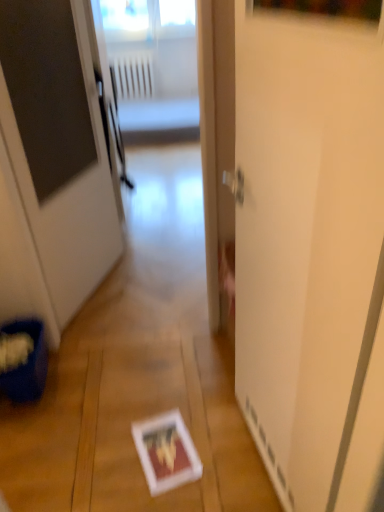
You are a GUI agent. You are given a task and a screenshot of the screen. Output one action in this format:
    pyautogui.click(x=<x>, y=<y>)
    Task: Click on the white glossy door at center
    
    Given the screenshot: What is the action you would take?
    52,163

Locate an element on the screen. The width and height of the screenshot is (384, 512). white plastic radiator at upper center is located at coordinates (133, 74).

From a real-world perspective, which is physically below, white plastic radiator at upper center or white glossy screen door at center?

white plastic radiator at upper center, from a real-world perspective.

What are the coordinates of `screen door that is above the white plastic radiator at upper center (from a real-world perspective)` in the screenshot? It's located at (311, 251).

From the picture: Considering the sizes of white plastic radiator at upper center and white glossy screen door at center in the image, is white plastic radiator at upper center taller or shorter than white glossy screen door at center?

In the image, white plastic radiator at upper center appears to be shorter than white glossy screen door at center.

How many degrees apart are the facing directions of white plastic radiator at upper center and white glossy screen door at center?

The angular difference between white plastic radiator at upper center and white glossy screen door at center is 81.9 degrees.

Can you confirm if white glossy screen door at center is shorter than white plastic radiator at upper center?

No, white glossy screen door at center is not shorter than white plastic radiator at upper center.

From the image's perspective, between white glossy screen door at center and white plastic radiator at upper center, who is located below?

white glossy screen door at center, from the image's perspective.

Considering the relative positions of white glossy screen door at center and white plastic radiator at upper center in the image provided, is white glossy screen door at center to the left or to the right of white plastic radiator at upper center?

In the image, white glossy screen door at center appears on the right side of white plastic radiator at upper center.

Would you say white glossy screen door at center is a long distance from white plastic radiator at upper center?

white glossy screen door at center is far away from white plastic radiator at upper center.

From a real-world perspective, is white plastic radiator at upper center above or below white glossy door at center?

A: In terms of real-world spatial position, white plastic radiator at upper center is below white glossy door at center.

Is point (116, 71) closer or farther from the camera than point (31, 71)?

Point (116, 71).

Can you tell me how much white plastic radiator at upper center and white glossy door at center differ in facing direction?

67.4 degrees.

Locate an element on the screen. The height and width of the screenshot is (512, 384). radiator lying above the white glossy door at center (from the image's perspective) is located at coordinates (133, 74).

From a real-world perspective, is white glossy door at center physically located above or below white plastic radiator at upper center?

white glossy door at center is situated higher than white plastic radiator at upper center in the real world.

Based on the photo, considering the sizes of objects white glossy door at center and white plastic radiator at upper center in the image provided, who is thinner, white glossy door at center or white plastic radiator at upper center?

Thinner between the two is white plastic radiator at upper center.

Could you tell me if white glossy door at center is facing white plastic radiator at upper center?

No, white glossy door at center is not oriented towards white plastic radiator at upper center.

Is white glossy screen door at center far from white glossy door at center?

Indeed, white glossy screen door at center is not near white glossy door at center.

The image size is (384, 512). In the image, there is a white glossy screen door at center. Identify the location of door above it (from the image's perspective). (52, 163).

From a real-world perspective, is white glossy screen door at center under white glossy door at center?

Indeed, from a real-world perspective, white glossy screen door at center is positioned beneath white glossy door at center.

Considering the positions of points (275, 65) and (64, 260), is point (275, 65) farther from camera compared to point (64, 260)?

No.

Between white glossy door at center and white glossy screen door at center, which one has larger size?

Bigger between the two is white glossy door at center.

Does point (88, 234) appear closer or farther from the camera than point (347, 226)?

Clearly, point (88, 234) is more distant from the camera than point (347, 226).

From the image's perspective, which is above, white glossy door at center or white glossy screen door at center?

white glossy door at center, from the image's perspective.

Can you confirm if white glossy door at center is taller than white glossy screen door at center?

Yes.

The width and height of the screenshot is (384, 512). What are the coordinates of `radiator that is behind the white glossy screen door at center` in the screenshot? It's located at (133, 74).

This screenshot has height=512, width=384. There is a white plastic radiator at upper center. In order to click on screen door above it (from a real-world perspective) in this screenshot , I will do tap(311, 251).

Based on the photo, based on their spatial positions, is white plastic radiator at upper center or white glossy screen door at center further from white glossy door at center?

The object further to white glossy door at center is white plastic radiator at upper center.

Based on their spatial positions, is white glossy screen door at center or white glossy door at center closer to white plastic radiator at upper center?

The object closer to white plastic radiator at upper center is white glossy door at center.

Which object lies nearer to the anchor point white glossy screen door at center, white plastic radiator at upper center or white glossy door at center?

white glossy door at center lies closer to white glossy screen door at center than the other object.

Looking at the image, which one is located further to white glossy door at center, white glossy screen door at center or white plastic radiator at upper center?

white plastic radiator at upper center is positioned further to the anchor white glossy door at center.

Considering their positions, is white glossy door at center positioned further to white glossy screen door at center than white plastic radiator at upper center?

white plastic radiator at upper center.

In the scene shown: From the image, which object appears to be nearer to white plastic radiator at upper center, white glossy door at center or white glossy screen door at center?

white glossy door at center lies closer to white plastic radiator at upper center than the other object.

This screenshot has height=512, width=384. I want to click on door positioned between white glossy screen door at center and white plastic radiator at upper center from near to far, so click(x=52, y=163).